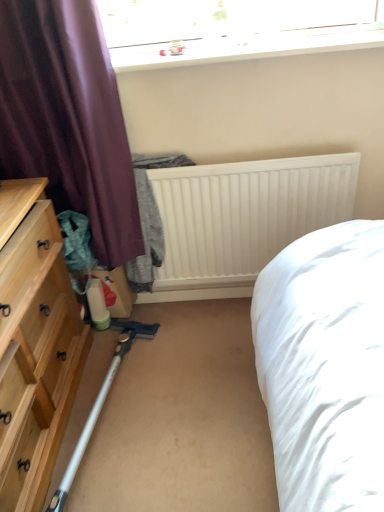
Question: From a real-world perspective, is transparent glass window at upper center located beneath natural wood dresser at left?

Choices:
 (A) no
 (B) yes

Answer: (A)

Question: Are transparent glass window at upper center and natural wood dresser at left located far from each other?

Choices:
 (A) no
 (B) yes

Answer: (B)

Question: Is transparent glass window at upper center facing towards natural wood dresser at left?

Choices:
 (A) yes
 (B) no

Answer: (B)

Question: Is natural wood dresser at left a part of transparent glass window at upper center?

Choices:
 (A) no
 (B) yes

Answer: (A)

Question: Is transparent glass window at upper center to the left of natural wood dresser at left from the viewer's perspective?

Choices:
 (A) yes
 (B) no

Answer: (B)

Question: Is transparent glass window at upper center not within natural wood dresser at left?

Choices:
 (A) no
 (B) yes

Answer: (B)

Question: From a real-world perspective, is white matte radiator at center over purple fabric curtain at left?

Choices:
 (A) yes
 (B) no

Answer: (B)

Question: Is white matte radiator at center oriented away from purple fabric curtain at left?

Choices:
 (A) yes
 (B) no

Answer: (B)

Question: Is white matte radiator at center thinner than purple fabric curtain at left?

Choices:
 (A) no
 (B) yes

Answer: (B)

Question: From the image's perspective, is white matte radiator at center on top of purple fabric curtain at left?

Choices:
 (A) yes
 (B) no

Answer: (B)

Question: Can you confirm if white matte radiator at center is wider than purple fabric curtain at left?

Choices:
 (A) no
 (B) yes

Answer: (A)

Question: Is white matte radiator at center touching purple fabric curtain at left?

Choices:
 (A) no
 (B) yes

Answer: (A)

Question: Is white matte radiator at center positioned far away from transparent glass window at upper center?

Choices:
 (A) yes
 (B) no

Answer: (B)